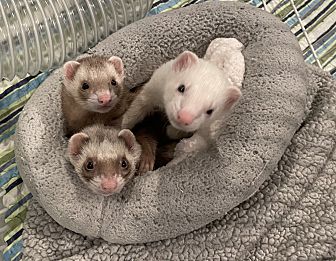
In order to click on rug in this screenshot , I will do `click(307, 214)`.